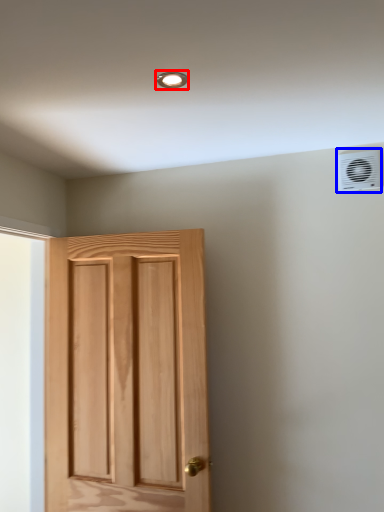
Question: Which object appears farthest to the camera in this image, light fixture (highlighted by a red box) or air conditioning (highlighted by a blue box)?

Choices:
 (A) light fixture
 (B) air conditioning

Answer: (B)